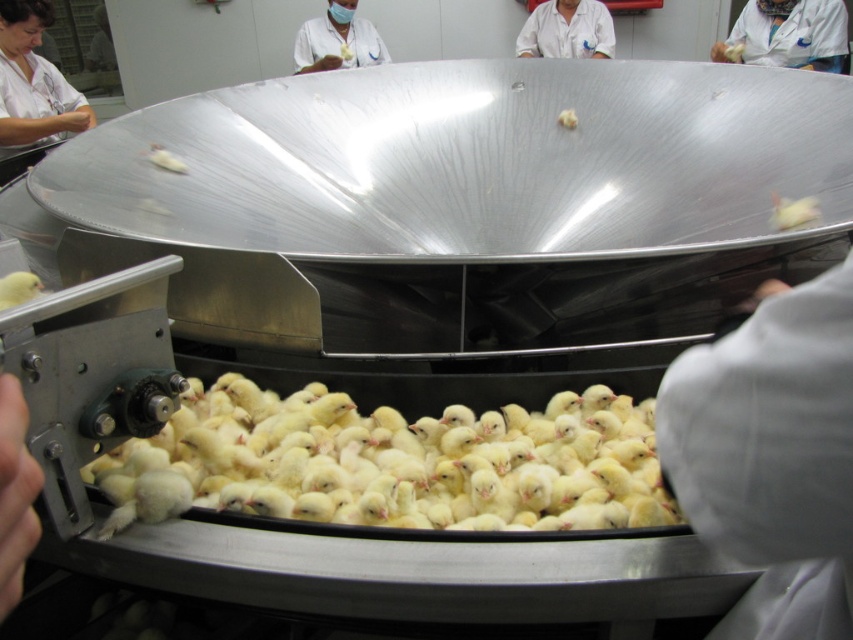
Question: Which object is positioned farthest from the white cloth at lower right?

Choices:
 (A) matte white chick at center
 (B) white lab coat at upper right
 (C) yellow fluffy chicks at center
 (D) white matte food at center

Answer: (B)

Question: Which point is farther from the camera taking this photo?

Choices:
 (A) (569, 129)
 (B) (16, 403)
 (C) (164, 157)
 (D) (207, 436)

Answer: (A)

Question: Which point appears farthest from the camera in this image?

Choices:
 (A) (587, 52)
 (B) (305, 28)

Answer: (B)

Question: From the image, what is the correct spatial relationship of matte white coat at upper center in relation to yellow fluffy chick at lower left?

Choices:
 (A) above
 (B) below

Answer: (A)

Question: Is matte white coat at left wider than white lab coat at upper right?

Choices:
 (A) no
 (B) yes

Answer: (A)

Question: Does white lab coat at upper center come in front of matte white chick at center?

Choices:
 (A) yes
 (B) no

Answer: (B)